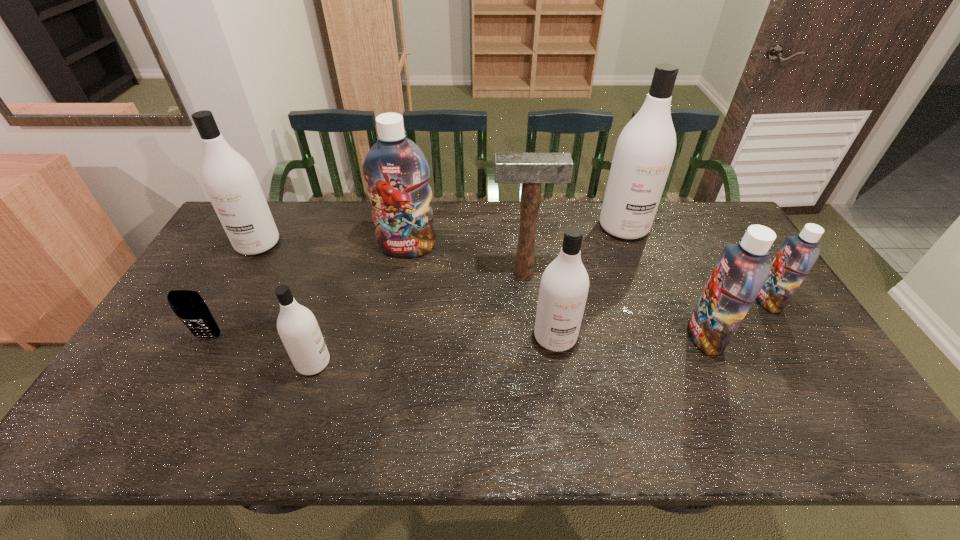
In order to click on the rightmost shampoo in this screenshot , I will do `click(798, 254)`.

Where is `the rightmost object`? the rightmost object is located at coordinates coord(798,254).

Identify the location of the smallest white shampoo. (297, 326).

Find the location of a particular element. This screenshot has height=540, width=960. the seventh object from right to left is located at coordinates point(297,326).

The height and width of the screenshot is (540, 960). Find the location of `cellular telephone`. cellular telephone is located at coordinates (190, 308).

This screenshot has height=540, width=960. In order to click on vacant space situated on the front-facing side of the rightmost white shampoo in this screenshot , I will do `click(662, 328)`.

This screenshot has height=540, width=960. Identify the location of free spot located 0.290m on the front-facing side of the leftmost shampoo. (210, 328).

Where is `vacant space located 0.290m on the front label of the third shampoo from left to right`? This screenshot has height=540, width=960. vacant space located 0.290m on the front label of the third shampoo from left to right is located at coordinates [393, 329].

I want to click on vacant area situated 0.080m on the front of the fourth farthest object, so [x=526, y=300].

You are a GUI agent. You are given a task and a screenshot of the screen. Output one action in this format:
    pyautogui.click(x=<x>, y=<y>)
    Task: Click on the vacant region located on the front label of the second smallest blue shampoo
    The height and width of the screenshot is (540, 960).
    Given the screenshot: What is the action you would take?
    pyautogui.click(x=667, y=336)